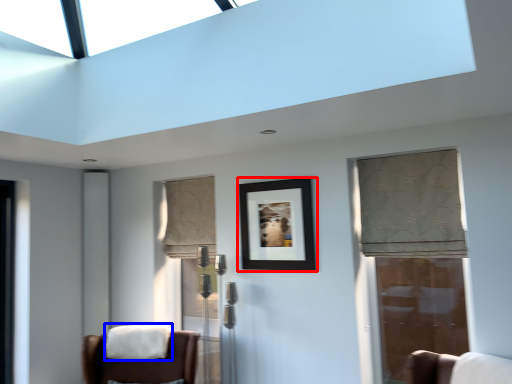
Question: Which object appears farthest to the camera in this image, picture frame (highlighted by a red box) or blanket (highlighted by a blue box)?

Choices:
 (A) picture frame
 (B) blanket

Answer: (B)